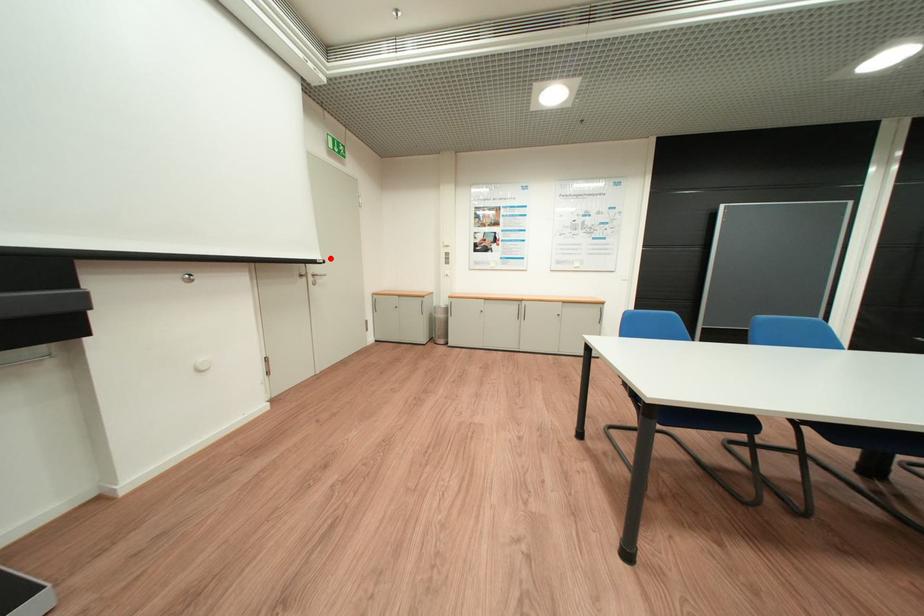
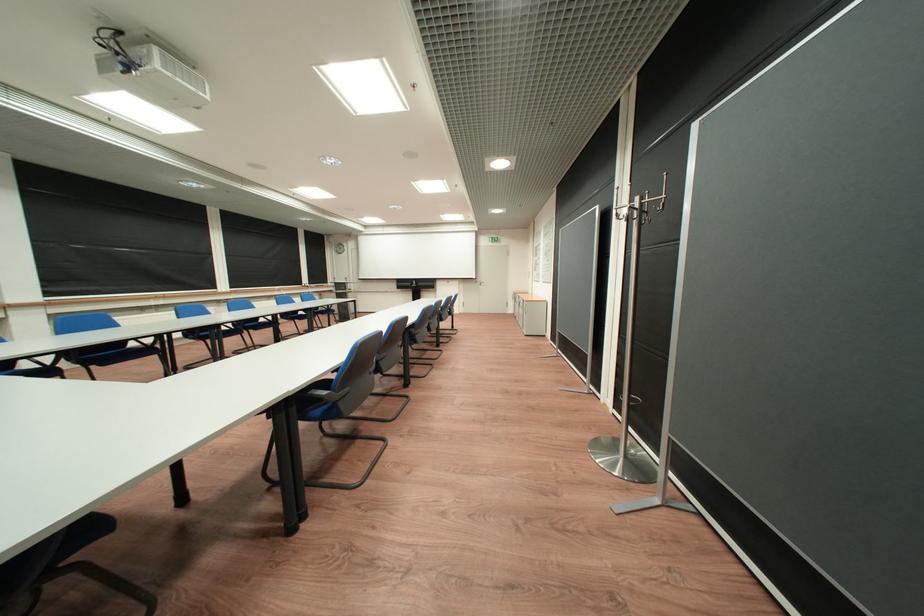
In the second image, find the point that corresponds to the highlighted location in the first image.

(487, 278)